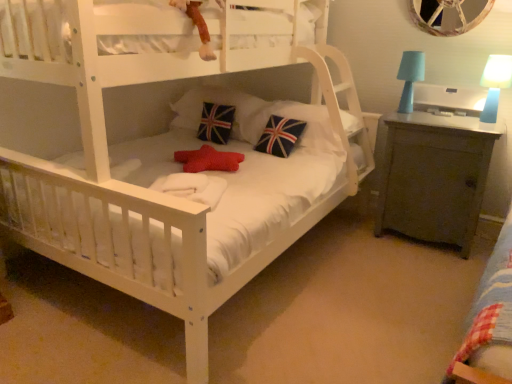
Question: Is matte gray cabinet at right inside velvety plush monkey at upper center?

Choices:
 (A) yes
 (B) no

Answer: (B)

Question: Does velvety plush monkey at upper center lie in front of matte gray cabinet at right?

Choices:
 (A) no
 (B) yes

Answer: (B)

Question: Considering the relative sizes of velvety plush monkey at upper center and matte gray cabinet at right in the image provided, is velvety plush monkey at upper center smaller than matte gray cabinet at right?

Choices:
 (A) yes
 (B) no

Answer: (A)

Question: Is velvety plush monkey at upper center looking in the opposite direction of matte gray cabinet at right?

Choices:
 (A) no
 (B) yes

Answer: (A)

Question: Can you confirm if velvety plush monkey at upper center is thinner than matte gray cabinet at right?

Choices:
 (A) yes
 (B) no

Answer: (A)

Question: Would you say matte blue lampshade at upper right, positioned as the second table lamp in right-to-left order, is inside or outside union jack fabric pillow at center, which ranks as the third pillow in left-to-right order?

Choices:
 (A) outside
 (B) inside

Answer: (A)

Question: Considering the positions of matte blue lampshade at upper right, positioned as the second table lamp in right-to-left order, and union jack fabric pillow at center, which ranks as the third pillow in left-to-right order, in the image, is matte blue lampshade at upper right, positioned as the second table lamp in right-to-left order, wider or thinner than union jack fabric pillow at center, which ranks as the third pillow in left-to-right order,?

Choices:
 (A) wide
 (B) thin

Answer: (B)

Question: Is matte blue lampshade at upper right, positioned as the second table lamp in right-to-left order, to the left or to the right of union jack fabric pillow at center, which ranks as the 1th pillow in right-to-left order, in the image?

Choices:
 (A) right
 (B) left

Answer: (A)

Question: Is matte blue lampshade at upper right, positioned as the second table lamp in right-to-left order, bigger or smaller than union jack fabric pillow at center, which ranks as the 1th pillow in right-to-left order?

Choices:
 (A) big
 (B) small

Answer: (B)

Question: Is matte blue lampshade at upper right, positioned as the second table lamp in right-to-left order, bigger or smaller than union jack fabric pillow at center, acting as the second pillow starting from the right?

Choices:
 (A) big
 (B) small

Answer: (B)

Question: From a real-world perspective, is matte blue lampshade at upper right, positioned as the second table lamp in right-to-left order, physically located above or below union jack fabric pillow at center, acting as the second pillow starting from the right?

Choices:
 (A) below
 (B) above

Answer: (B)

Question: Is point (402, 59) closer or farther from the camera than point (195, 117)?

Choices:
 (A) closer
 (B) farther

Answer: (A)

Question: From their relative heights in the image, would you say matte blue lampshade at upper right, positioned as the second table lamp in right-to-left order, is taller or shorter than union jack fabric pillow at center, acting as the second pillow starting from the right?

Choices:
 (A) tall
 (B) short

Answer: (A)

Question: Considering their positions, is union jack fabric pillow at center, acting as the 3th pillow starting from the right, located in front of or behind velvety plush monkey at upper center?

Choices:
 (A) front
 (B) behind

Answer: (B)

Question: In terms of size, does union jack fabric pillow at center, acting as the 3th pillow starting from the right, appear bigger or smaller than velvety plush monkey at upper center?

Choices:
 (A) big
 (B) small

Answer: (A)